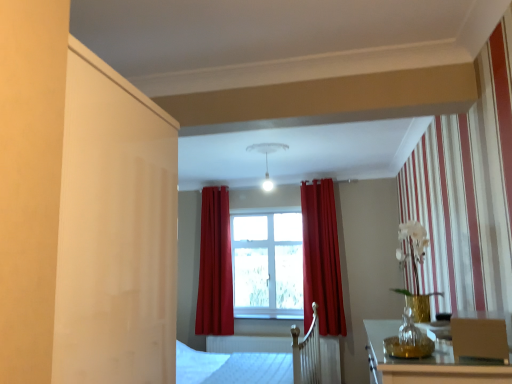
Measure the distance between point (402, 332) and camera.

Point (402, 332) and camera are 5.39 feet apart from each other.

The width and height of the screenshot is (512, 384). What are the coordinates of `white wood bed frame at center` in the screenshot? It's located at (262, 359).

In order to face matte red curtain at center, arranged as the second curtain when viewed from the right, should I rotate leftwards or rightwards?

Turn left by 6.024 degrees to look at matte red curtain at center, arranged as the second curtain when viewed from the right.

What is the approximate width of matte red curtain at center, arranged as the second curtain when viewed from the right?

matte red curtain at center, arranged as the second curtain when viewed from the right, is 9.04 inches in width.

At what (x,y) coordinates should I click in order to perform the action: click on transparent glass vase at lower right. Please return your answer as a coordinate pair (x, y). This screenshot has width=512, height=384. Looking at the image, I should click on (409, 339).

Based on their positions, is clear glass window at center located to the left or right of matte brown armchair at lower right?

clear glass window at center is positioned on matte brown armchair at lower right's left side.

In the scene shown: Would you say clear glass window at center is inside or outside matte brown armchair at lower right?

clear glass window at center exists outside the volume of matte brown armchair at lower right.

Is clear glass window at center smaller than matte brown armchair at lower right?

Incorrect, clear glass window at center is not smaller in size than matte brown armchair at lower right.

Are clear glass window at center and matte brown armchair at lower right far apart?

clear glass window at center is positioned a significant distance from matte brown armchair at lower right.

Would you say matte brown armchair at lower right is inside or outside transparent glass vase at lower right?

matte brown armchair at lower right is spatially situated outside transparent glass vase at lower right.

From the image's perspective, is matte brown armchair at lower right above or below transparent glass vase at lower right?

matte brown armchair at lower right is below transparent glass vase at lower right.

I want to click on armchair below the transparent glass vase at lower right (from the image's perspective), so click(479, 338).

Is matte brown armchair at lower right positioned with its back to transparent glass vase at lower right?

No, transparent glass vase at lower right is not at the back of matte brown armchair at lower right.

Which point is more distant from viewer, [408,307] or [232,290]?

The point [232,290] is behind.

From the image's perspective, which object appears higher, transparent glass vase at lower right or matte red curtain at center, arranged as the second curtain when viewed from the right?

transparent glass vase at lower right, from the image's perspective.

Looking at the image, does transparent glass vase at lower right seem bigger or smaller compared to matte red curtain at center, arranged as the second curtain when viewed from the right?

Considering their sizes, transparent glass vase at lower right takes up less space than matte red curtain at center, arranged as the second curtain when viewed from the right.

Considering the relative sizes of transparent glass vase at lower right and matte red curtain at center, arranged as the second curtain when viewed from the right, in the image provided, is transparent glass vase at lower right wider than matte red curtain at center, arranged as the second curtain when viewed from the right,?

In fact, transparent glass vase at lower right might be narrower than matte red curtain at center, arranged as the second curtain when viewed from the right.

Considering the positions of point (209, 331) and point (271, 290), is point (209, 331) closer or farther from the camera than point (271, 290)?

Point (209, 331) appears to be closer to the viewer than point (271, 290).

Looking at this image, from a real-world perspective, is matte red curtain at center, arranged as the second curtain when viewed from the right, beneath clear glass window at center?

Actually, matte red curtain at center, arranged as the second curtain when viewed from the right, is physically above clear glass window at center in the real world.

Considering the sizes of matte red curtain at center, arranged as the first curtain when viewed from the left, and clear glass window at center in the image, is matte red curtain at center, arranged as the first curtain when viewed from the left, bigger or smaller than clear glass window at center?

In the image, matte red curtain at center, arranged as the first curtain when viewed from the left, appears to be larger than clear glass window at center.

Identify the location of window beneath the matte red curtain at center, arranged as the second curtain when viewed from the right (from a real-world perspective). (267, 266).

Can you confirm if matte brown armchair at lower right is shorter than white matte light fixture at upper center?

Indeed, matte brown armchair at lower right has a lesser height compared to white matte light fixture at upper center.

Based on their sizes in the image, would you say matte brown armchair at lower right is bigger or smaller than white matte light fixture at upper center?

In the image, matte brown armchair at lower right appears to be smaller than white matte light fixture at upper center.

How many degrees apart are the facing directions of matte brown armchair at lower right and white matte light fixture at upper center?

matte brown armchair at lower right and white matte light fixture at upper center are facing 105 degrees away from each other.

Is point (265, 156) behind point (319, 362)?

Yes, point (265, 156) is behind point (319, 362).

Based on their positions, is white matte light fixture at upper center located to the left or right of white wood bed frame at center?

In the image, white matte light fixture at upper center appears on the left side of white wood bed frame at center.

Is white matte light fixture at upper center not inside white wood bed frame at center?

That's correct, white matte light fixture at upper center is outside of white wood bed frame at center.

Is white matte light fixture at upper center in front of or behind white wood bed frame at center in the image?

Clearly, white matte light fixture at upper center is in front of white wood bed frame at center.

How different are the orientations of matte red curtain at center, the second curtain from the left, and matte brown armchair at lower right in degrees?

106 degrees.

From a real-world perspective, which object stands above the other?

matte red curtain at center, which ranks as the 1th curtain in right-to-left order, is physically above.

Identify the location of armchair above the matte red curtain at center, the second curtain from the left (from the image's perspective). The width and height of the screenshot is (512, 384). (479, 338).

Can you confirm if matte red curtain at center, the second curtain from the left, is smaller than matte brown armchair at lower right?

Actually, matte red curtain at center, the second curtain from the left, might be larger than matte brown armchair at lower right.

Where is `armchair located underneath the clear glass window at center (from a real-world perspective)`? armchair located underneath the clear glass window at center (from a real-world perspective) is located at coordinates (479, 338).

Where is `armchair below the transparent glass vase at lower right (from the image's perspective)`? armchair below the transparent glass vase at lower right (from the image's perspective) is located at coordinates (479, 338).

Estimate the real-world distances between objects in this image. Which object is further from matte brown armchair at lower right, matte red curtain at center, arranged as the first curtain when viewed from the left, or white matte light fixture at upper center?

matte red curtain at center, arranged as the first curtain when viewed from the left, lies further to matte brown armchair at lower right than the other object.

Based on their spatial positions, is clear glass window at center or matte red curtain at center, arranged as the first curtain when viewed from the left, further from transparent glass vase at lower right?

Based on the image, matte red curtain at center, arranged as the first curtain when viewed from the left, appears to be further to transparent glass vase at lower right.

In the scene shown: From the image, which object appears to be farther from matte brown armchair at lower right, white wood bed frame at center or matte red curtain at center, arranged as the second curtain when viewed from the right?

matte red curtain at center, arranged as the second curtain when viewed from the right.

From the image, which object appears to be nearer to white matte light fixture at upper center, matte brown armchair at lower right or transparent glass vase at lower right?

Among the two, transparent glass vase at lower right is located nearer to white matte light fixture at upper center.

Looking at the image, which one is located closer to clear glass window at center, matte red curtain at center, arranged as the second curtain when viewed from the right, or transparent glass vase at lower right?

The object closer to clear glass window at center is matte red curtain at center, arranged as the second curtain when viewed from the right.

Which object lies nearer to the anchor point matte red curtain at center, arranged as the second curtain when viewed from the right, clear glass window at center or matte red curtain at center, which ranks as the 1th curtain in right-to-left order?

clear glass window at center.

Considering their positions, is transparent glass vase at lower right positioned closer to white wood bed frame at center than matte red curtain at center, which ranks as the 1th curtain in right-to-left order?

Based on the image, matte red curtain at center, which ranks as the 1th curtain in right-to-left order, appears to be nearer to white wood bed frame at center.

From the image, which object appears to be farther from matte red curtain at center, the second curtain from the left, white matte light fixture at upper center or transparent glass vase at lower right?

Among the two, transparent glass vase at lower right is located further to matte red curtain at center, the second curtain from the left.

Locate an element on the screen. The width and height of the screenshot is (512, 384). light fixture located between matte brown armchair at lower right and matte red curtain at center, arranged as the second curtain when viewed from the right, in the depth direction is located at coordinates (267, 158).

Where is `curtain between transparent glass vase at lower right and white wood bed frame at center along the z-axis`? curtain between transparent glass vase at lower right and white wood bed frame at center along the z-axis is located at coordinates (x=321, y=258).

This screenshot has height=384, width=512. I want to click on glass vase positioned between matte brown armchair at lower right and white matte light fixture at upper center from near to far, so click(409, 339).

This screenshot has height=384, width=512. What are the coordinates of `glass vase between matte brown armchair at lower right and clear glass window at center from front to back` in the screenshot? It's located at (409, 339).